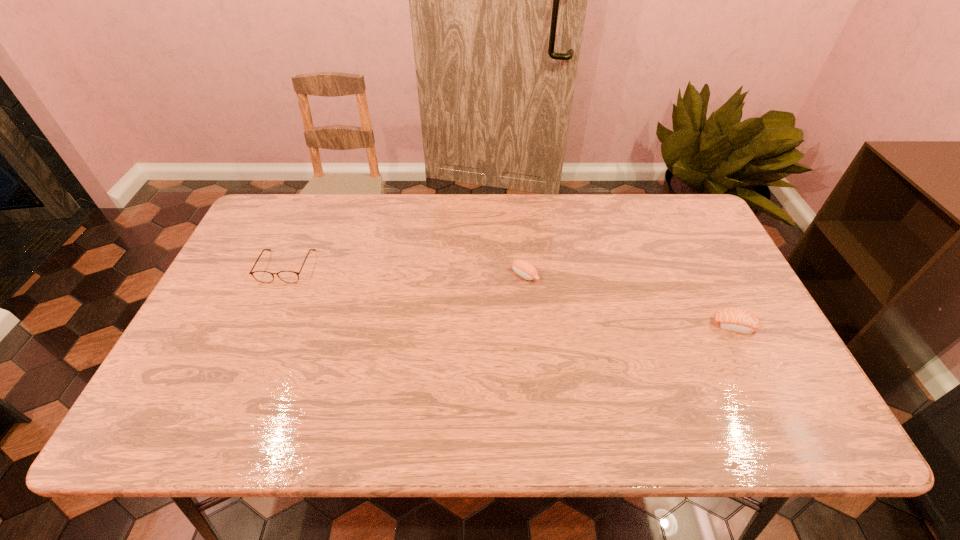
Where is `free space between the spectacles and the right sushi`? This screenshot has height=540, width=960. free space between the spectacles and the right sushi is located at coordinates point(511,296).

This screenshot has width=960, height=540. What are the coordinates of `free spot between the farther sushi and the leftmost object` in the screenshot? It's located at (406, 271).

Identify the location of free space between the left sushi and the leftmost object. The height and width of the screenshot is (540, 960). (406, 271).

This screenshot has width=960, height=540. Find the location of `vacant area that lies between the leftmost object and the nearest object`. vacant area that lies between the leftmost object and the nearest object is located at coordinates (511, 296).

Locate an element on the screen. empty location between the spectacles and the nearest object is located at coordinates (511, 296).

At what (x,y) coordinates should I click in order to perform the action: click on free spot between the leftmost object and the second object from left to right. Please return your answer as a coordinate pair (x, y). This screenshot has height=540, width=960. Looking at the image, I should click on (406, 271).

Where is `vacant point located between the rightmost object and the leftmost object`? The width and height of the screenshot is (960, 540). vacant point located between the rightmost object and the leftmost object is located at coordinates (511, 296).

At what (x,y) coordinates should I click in order to perform the action: click on the second closest object relative to the right sushi. Please return your answer as a coordinate pair (x, y). Looking at the image, I should click on (261, 276).

Locate an element on the screen. object that is the second nearest to the leftmost object is located at coordinates (736, 320).

This screenshot has height=540, width=960. Identify the location of blank space that satisfies the following two spatial constraints: 1. on the front-facing side of the second object from left to right; 2. on the left side of the leftmost object. (282, 275).